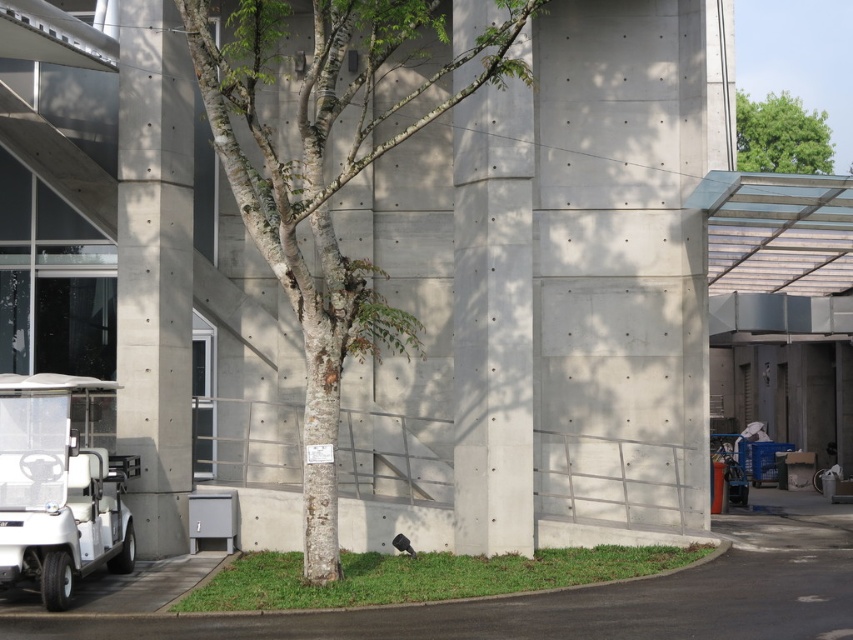
Question: Which of the following is the closest to the observer?

Choices:
 (A) (740, 141)
 (B) (54, 417)
 (C) (177, 440)
 (D) (271, 220)

Answer: (B)

Question: Which object is closer to the camera taking this photo?

Choices:
 (A) smooth bark tree at center
 (B) concrete at center
 (C) concrete at left
 (D) green leafy tree at upper right

Answer: (B)

Question: Can you confirm if smooth bark tree at center is wider than concrete at left?

Choices:
 (A) no
 (B) yes

Answer: (A)

Question: Can you confirm if concrete at center is bigger than concrete at left?

Choices:
 (A) yes
 (B) no

Answer: (B)

Question: Which point is closer to the camera taking this photo?

Choices:
 (A) (119, 284)
 (B) (456, 131)
 (C) (26, 404)
 (D) (372, 148)

Answer: (C)

Question: Does concrete at center appear on the left side of white matte golf cart at lower left?

Choices:
 (A) no
 (B) yes

Answer: (A)